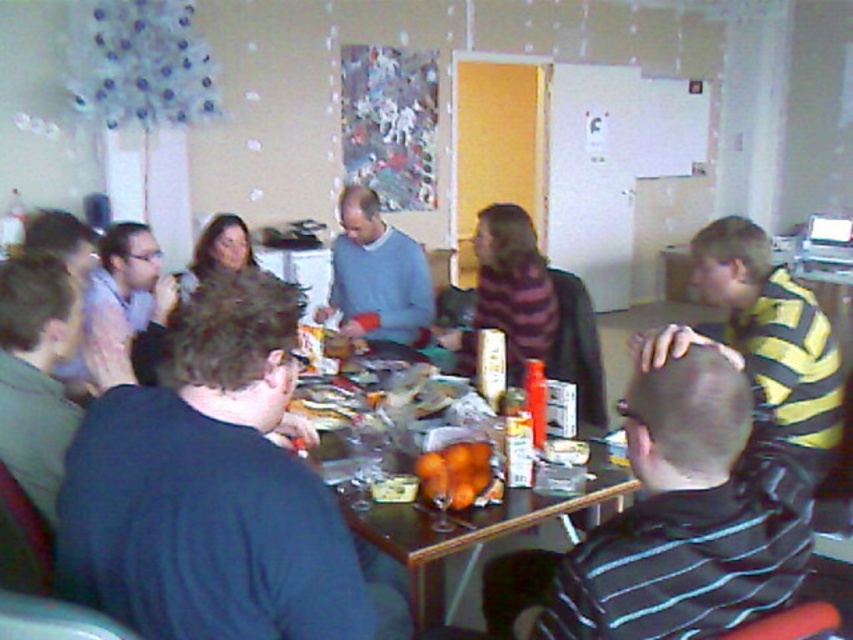
You are sitting at the table and want to move your dark blue sweater at left to the right side of the matte blue sweater at center. Is this possible without moving any other items?

The dark blue sweater at left is already to the left of the matte blue sweater at center, so moving it to the right side would require shifting its position relative to the matte blue sweater at center. Since the question allows moving only the dark blue sweater at left and not other items, it is possible as long as there is space to the right of the matte blue sweater at center. However, the description does not provide information about available space, so we can only confirm the current positions.

You are standing in the room and want to reach the wooden table at center. Which direction should you move relative to the yellow striped shirt at right?

The wooden table at center is behind the yellow striped shirt at right, so you should move behind the yellow striped shirt at right to reach the wooden table at center.

You are organizing a clothing donation drive and need to stack the matte blue sweater at center and the matte black sweater at center vertically. Given that the storage bin you have can only accommodate items up to the height of the taller sweater, will both sweaters fit when stacked?

The matte blue sweater at center is taller than the matte black sweater at center. Since the storage bin can only accommodate up to the height of the taller sweater, stacking both would exceed the bin capacity. Therefore, they cannot both fit when stacked.